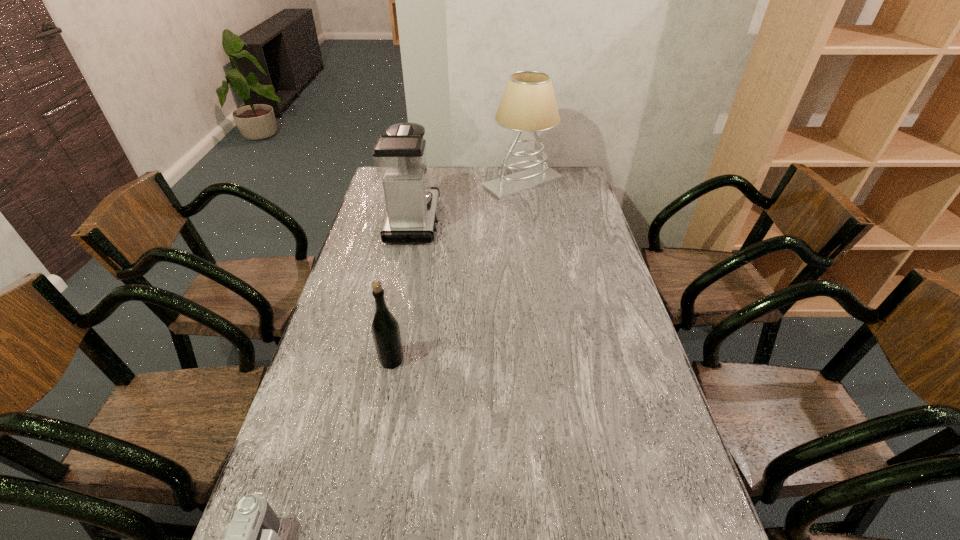
Where is `object at the right edge`? This screenshot has width=960, height=540. object at the right edge is located at coordinates (528, 104).

This screenshot has width=960, height=540. I want to click on object positioned at the far right corner, so click(528, 104).

Identify the location of free space at the far edge of the desktop. (463, 183).

Identify the location of vacant space at the left edge. This screenshot has width=960, height=540. [x=312, y=424].

In the image, there is a desktop. Identify the location of vacant space at the right edge. This screenshot has width=960, height=540. (661, 414).

Locate an element on the screen. This screenshot has width=960, height=540. free space between the second nearest object and the coffee maker is located at coordinates (403, 291).

Find the location of a particular element. free spot between the table lamp and the beer bottle is located at coordinates (457, 272).

This screenshot has width=960, height=540. What are the coordinates of `free area in between the coffee maker and the tallest object` in the screenshot? It's located at (468, 201).

Locate an element on the screen. free space between the third farthest object and the tallest object is located at coordinates (457, 272).

Where is `the third closest object to the coffee maker`? the third closest object to the coffee maker is located at coordinates (252, 539).